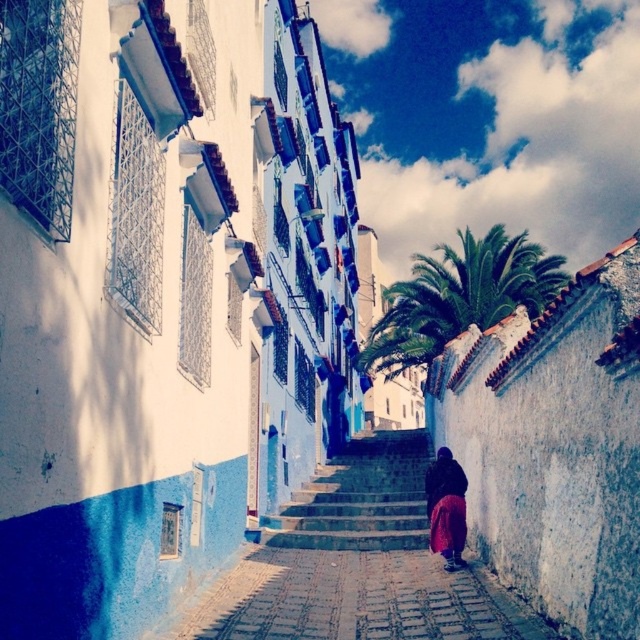
Question: Does blue stone stairs at center appear under dark purple fabric at center?

Choices:
 (A) yes
 (B) no

Answer: (A)

Question: Which point is closer to the camera taking this photo?

Choices:
 (A) (412, 436)
 (B) (356, 624)
 (C) (438, 532)
 (D) (470, 266)

Answer: (B)

Question: Estimate the real-world distances between objects in this image. Which object is closer to the dark purple fabric at center?

Choices:
 (A) blue stone stairs at center
 (B) green leafy palm at upper center
 (C) smooth stone steps at center

Answer: (C)

Question: Does green leafy palm at upper center appear on the left side of dark purple fabric at center?

Choices:
 (A) no
 (B) yes

Answer: (A)

Question: Considering the real-world distances, which object is farthest from the smooth stone steps at center?

Choices:
 (A) dark purple fabric at center
 (B) green leafy palm at upper center

Answer: (B)

Question: Is green leafy palm at upper center to the left of dark purple fabric at center from the viewer's perspective?

Choices:
 (A) yes
 (B) no

Answer: (B)